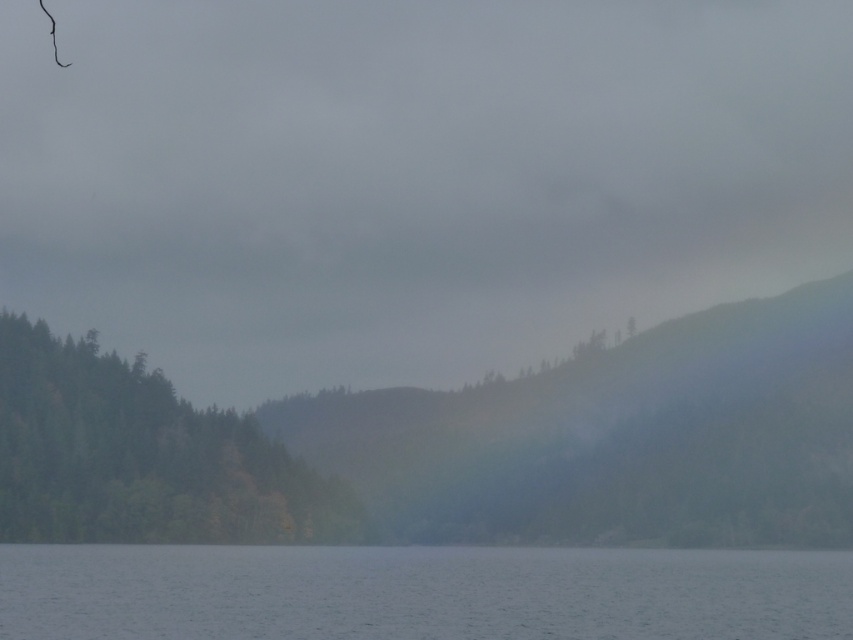
Can you confirm if transparent water at lower center is wider than green matte forest at left?

Yes, transparent water at lower center is wider than green matte forest at left.

Who is lower down, transparent water at lower center or green matte forest at left?

transparent water at lower center is lower down.

This screenshot has width=853, height=640. I want to click on transparent water at lower center, so click(x=421, y=593).

Find the location of a particular element. transparent water at lower center is located at coordinates (421, 593).